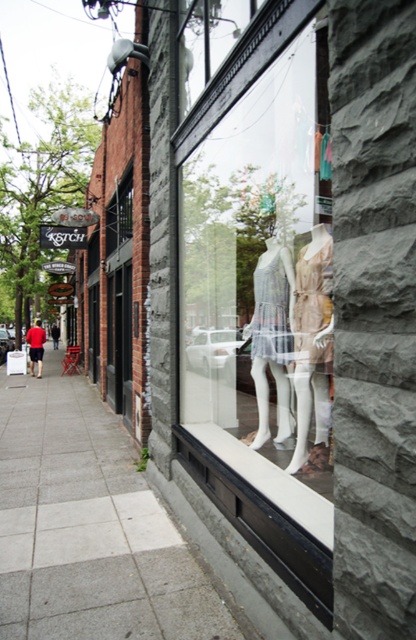
Can you confirm if transparent glass mannequins at center is thinner than white sheer fabric dress at center?

No, transparent glass mannequins at center is not thinner than white sheer fabric dress at center.

Is the position of transparent glass mannequins at center less distant than that of white sheer fabric dress at center?

Yes.

Find the location of a particular element. transparent glass mannequins at center is located at coordinates (262, 268).

Does transparent glass mannequins at center have a larger size compared to white fabric dress at center?

Indeed, transparent glass mannequins at center has a larger size compared to white fabric dress at center.

Does transparent glass mannequins at center have a lesser width compared to white fabric dress at center?

No.

Is point (240, 128) positioned in front of point (264, 420)?

Yes.

The width and height of the screenshot is (416, 640). I want to click on transparent glass mannequins at center, so click(x=262, y=268).

Which is in front, point (19, 516) or point (324, 282)?

Point (324, 282)

Who is more distant from viewer, (98,560) or (302,248)?

The point (98,560) is behind.

At what (x,y) coordinates should I click in order to perform the action: click on gray concrete sidewalk at lower left. Please return your answer as a coordinate pair (x, y). The width and height of the screenshot is (416, 640). Looking at the image, I should click on (89, 525).